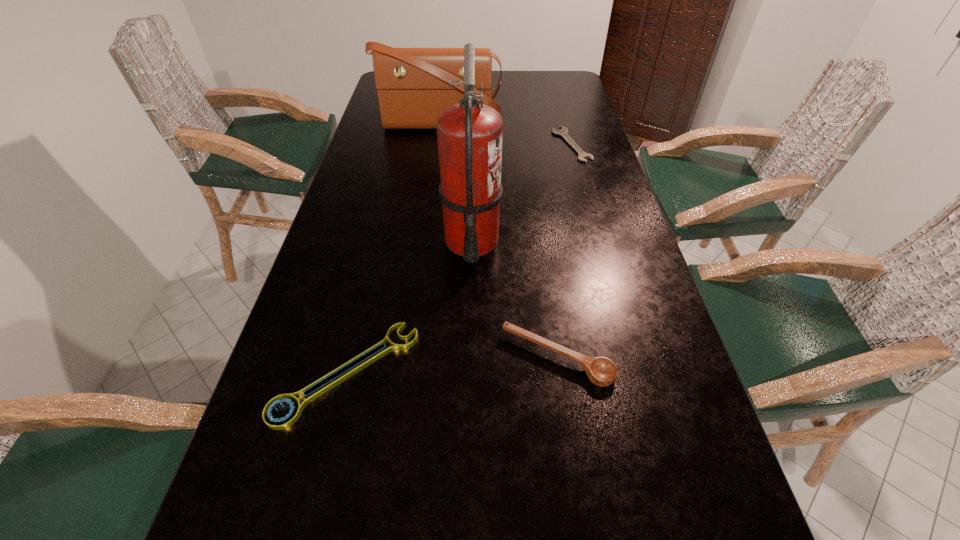
This screenshot has width=960, height=540. What are the coordinates of `free spot between the satchel and the nearer wrench` in the screenshot? It's located at tap(394, 249).

Where is `free space between the right wrench and the wooden spoon`? This screenshot has height=540, width=960. free space between the right wrench and the wooden spoon is located at coordinates (564, 251).

Where is `free area in between the farther wrench and the satchel`? free area in between the farther wrench and the satchel is located at coordinates (506, 134).

Where is `vacant point located between the third tallest object and the satchel`? The image size is (960, 540). vacant point located between the third tallest object and the satchel is located at coordinates (498, 241).

I want to click on vacant space in between the right wrench and the satchel, so click(506, 134).

Image resolution: width=960 pixels, height=540 pixels. Find the location of `free space between the right wrench and the tallest object`. free space between the right wrench and the tallest object is located at coordinates (521, 193).

At what (x,y) coordinates should I click in order to perform the action: click on vacant point located between the second tallest object and the left wrench. Please return your answer as a coordinate pair (x, y). The image size is (960, 540). Looking at the image, I should click on (394, 249).

You are a GUI agent. You are given a task and a screenshot of the screen. Output one action in this format:
    pyautogui.click(x=<x>, y=<y>)
    Task: Click on the vacant space in between the third shortest object and the fire extinguisher
    
    Given the screenshot: What is the action you would take?
    pyautogui.click(x=515, y=299)

Image resolution: width=960 pixels, height=540 pixels. What are the coordinates of `object that can be found as the third closest to the right wrench` in the screenshot? It's located at (601, 371).

Locate an element on the screen. This screenshot has height=540, width=960. object identified as the closest to the wooden spoon is located at coordinates (279, 424).